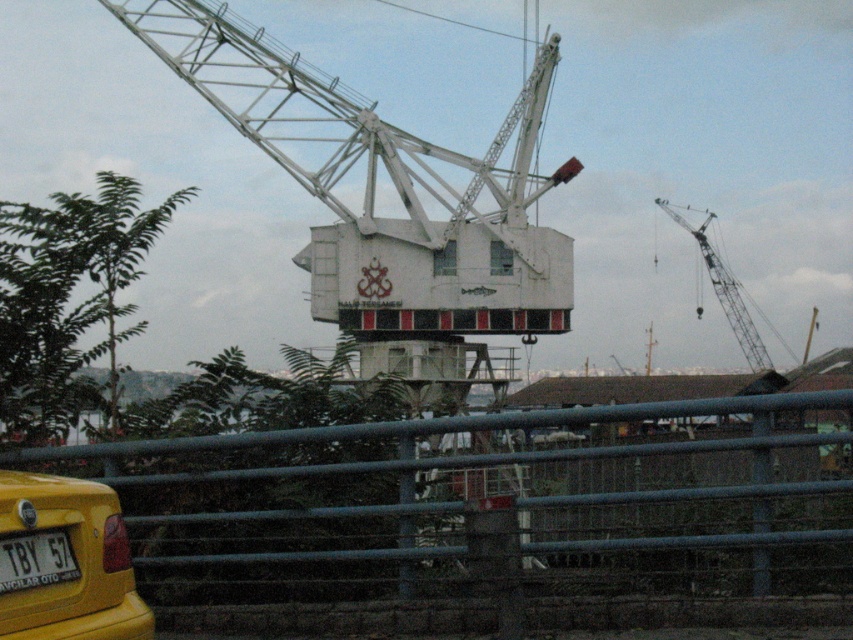
Between metallic gray fence at lower center and white metallic crane at upper right, which one has more height?

metallic gray fence at lower center

Between metallic gray fence at lower center and white metallic crane at upper right, which one is positioned lower?

metallic gray fence at lower center is below.

Is point (445, 627) closer to viewer compared to point (770, 365)?

Yes, it is.

The height and width of the screenshot is (640, 853). Find the location of `metallic gray fence at lower center`. metallic gray fence at lower center is located at coordinates (477, 524).

Does yellow plastic license plate at lower left have a lesser width compared to white metallic crane at upper right?

Indeed, yellow plastic license plate at lower left has a lesser width compared to white metallic crane at upper right.

Is yellow plastic license plate at lower left positioned before white metallic crane at upper right?

Yes, yellow plastic license plate at lower left is closer to the viewer.

You are a GUI agent. You are given a task and a screenshot of the screen. Output one action in this format:
    pyautogui.click(x=<x>, y=<y>)
    Task: Click on the yellow plastic license plate at lower left
    The width and height of the screenshot is (853, 640).
    Given the screenshot: What is the action you would take?
    pyautogui.click(x=35, y=561)

Locate an element on the screen. yellow plastic license plate at lower left is located at coordinates (35, 561).

Between point (68, 620) and point (18, 557), which one is positioned in front?

Point (18, 557) is more forward.

Is point (82, 620) behind point (67, 572)?

No, (82, 620) is in front of (67, 572).

The width and height of the screenshot is (853, 640). I want to click on yellow matte taxi at lower left, so click(65, 561).